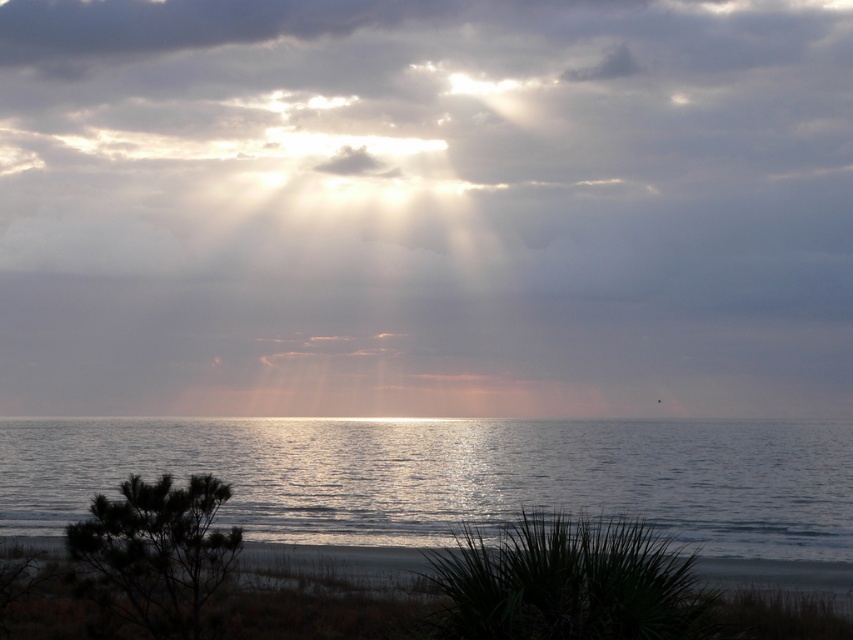
Question: Which point is farther to the camera?

Choices:
 (A) (12, 483)
 (B) (605, 106)
 (C) (74, 602)

Answer: (B)

Question: Among these objects, which one is farthest from the camera?

Choices:
 (A) dark sand at lower center
 (B) glistening water at lower center
 (C) cloudy at upper center

Answer: (C)

Question: Does cloudy at upper center have a larger size compared to dark sand at lower center?

Choices:
 (A) yes
 (B) no

Answer: (A)

Question: Does cloudy at upper center have a larger size compared to glistening water at lower center?

Choices:
 (A) yes
 (B) no

Answer: (A)

Question: Among these points, which one is nearest to the camera?

Choices:
 (A) (314, 605)
 (B) (776, 520)
 (C) (351, 28)

Answer: (A)

Question: Can you confirm if cloudy at upper center is positioned to the left of glistening water at lower center?

Choices:
 (A) yes
 (B) no

Answer: (A)